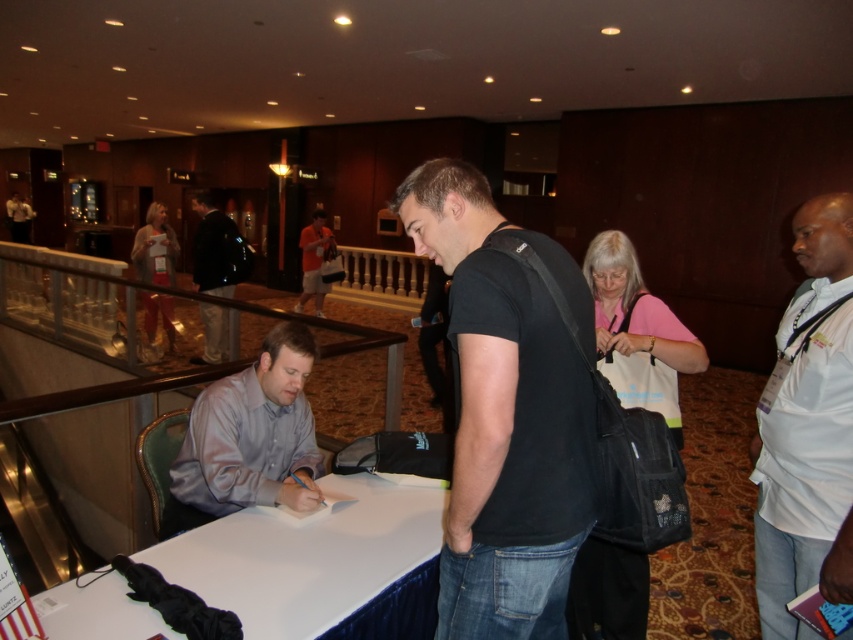
Question: Among these objects, which one is nearest to the camera?

Choices:
 (A) dark blue jeans at center
 (B) white paper at center
 (C) silky purple shirt at center
 (D) white cotton shirt at right

Answer: (B)

Question: Estimate the real-world distances between objects in this image. Which object is farther from the white paper at center?

Choices:
 (A) silky purple shirt at center
 (B) white cotton shirt at right

Answer: (B)

Question: Is silky purple shirt at center below dark blue jeans at center?

Choices:
 (A) no
 (B) yes

Answer: (B)

Question: Does white cotton shirt at right have a smaller size compared to dark blue jeans at center?

Choices:
 (A) yes
 (B) no

Answer: (B)

Question: Considering the relative positions of silky purple shirt at center and dark blue jeans at center in the image provided, where is silky purple shirt at center located with respect to dark blue jeans at center?

Choices:
 (A) above
 (B) below

Answer: (B)

Question: Which object is the farthest from the black matte t-shirt at center?

Choices:
 (A) silky purple shirt at center
 (B) white cotton shirt at right
 (C) white paper at center

Answer: (A)